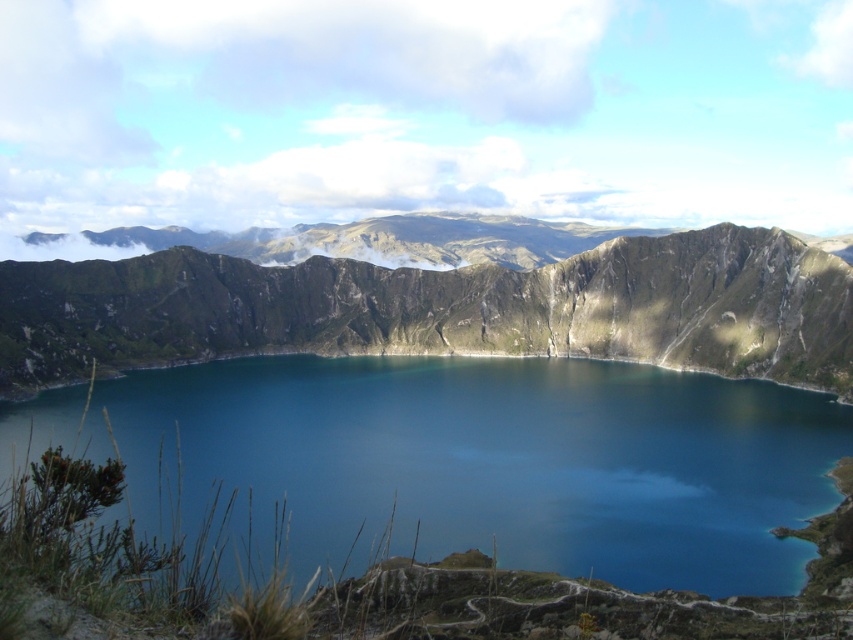
You are a hiker standing at the edge of the volcanic crater lake. You notice the blue glassy water at center and the rugged stone mountain at center. Which object is positioned higher in the scene?

The rugged stone mountain at center is positioned higher than the blue glassy water at center because the blue glassy water at center is located below it.

You are a hiker standing at the edge of the volcanic crater lake. You notice a point marked at coordinates (492, 461). What object is located at that point?

The blue glassy water at center is located at point (492, 461).

You are standing at the edge of the volcanic crater lake and want to take a photo. You see two points marked in the image. Which point is closer to you, point (624, 448) or point (202, 358)?

Point (624, 448) is closer to you than point (202, 358).